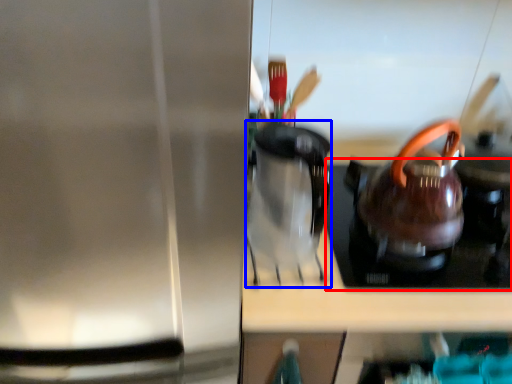
Question: Which object appears farthest to the camera in this image, gas stove (highlighted by a red box) or coffeepot (highlighted by a blue box)?

Choices:
 (A) gas stove
 (B) coffeepot

Answer: (A)